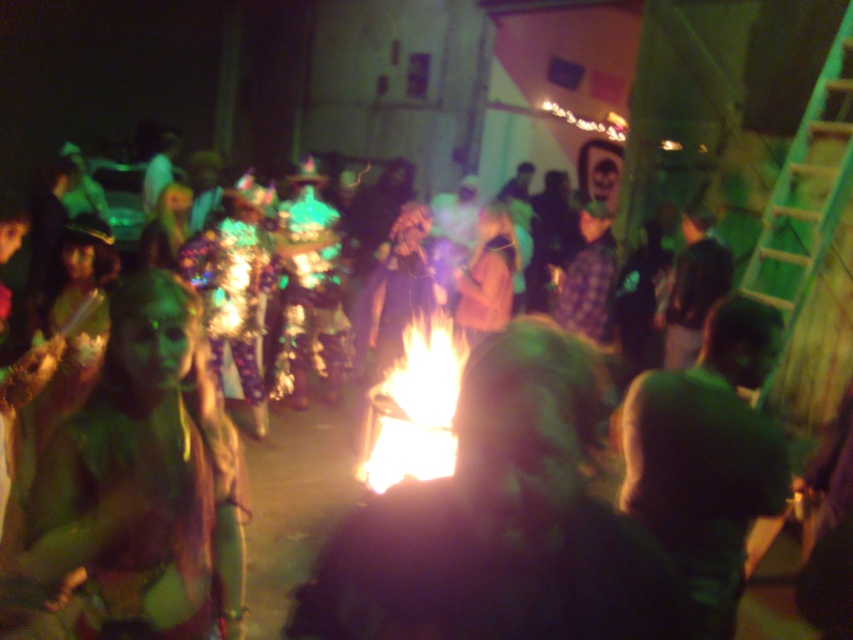
Consider the image. You are a photographer at the event and want to capture a photo that includes both the green matte shirt at right and the bright orange flames at center. Which object should be placed closer to the camera to ensure both fit in the frame?

The green matte shirt at right has a lesser width compared to bright orange flames at center, so to ensure both fit in the frame, the green matte shirt at right should be placed closer to the camera since it is smaller in width and requires less space.

You are at the party and want to move closer to the bright orange flames at center without getting too close to the green matte shirt at right. What should you do?

Move towards the bright orange flames at center while staying away from the green matte shirt at right, as the shirt is 6.15 feet away from the flames. This allows you to approach the flames while maintaining a distance from the shirt.